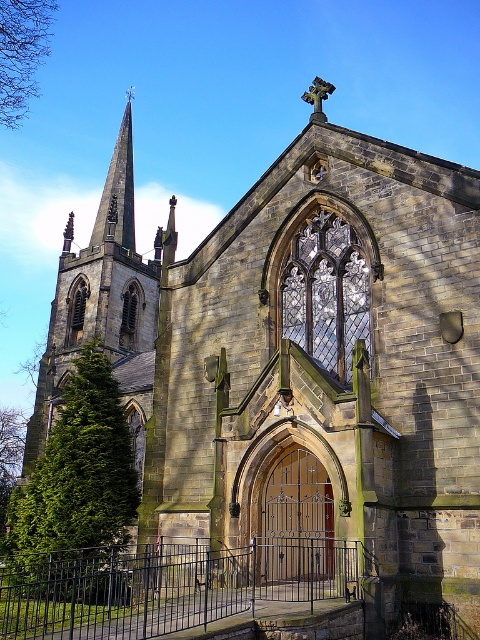
You are standing in front of the Gothic church and want to enter through the entrance. Where is the black metal fence at center located relative to the entrance?

The black metal fence at center is located at point (164, 586) relative to the entrance.

You are standing outside the Gothic church and want to take a photo of the entrance. There is a black metal fence at center and a smooth stone spire at upper left in your view. Which object will block your view of the entrance if you stand too close?

The black metal fence at center is in front of the smooth stone spire at upper left, so standing too close might cause the black metal fence at center to block your view of the entrance.

Based on the photo, you are standing in front of the Gothic church and notice two points marked on the image. The first point is at coordinates point (156, 586) and the second is at point (129, 184). Which point is nearer to your current position?

Point (156, 586) is closer to the camera than point (129, 184), so the first point is nearer to your current position.